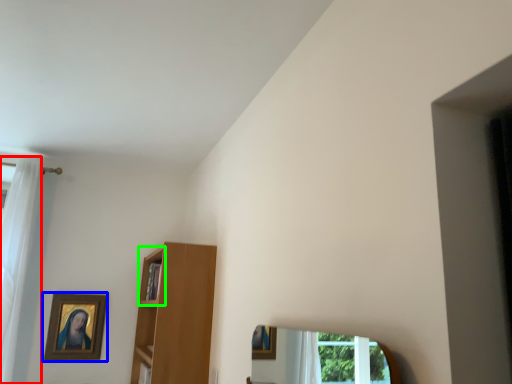
Question: Which object is positioned closest to curtain (highlighted by a red box)? Select from picture frame (highlighted by a blue box) and cabinet (highlighted by a green box).

Choices:
 (A) picture frame
 (B) cabinet

Answer: (A)